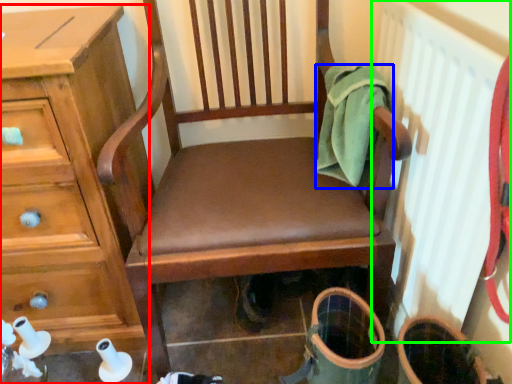
Question: Considering the real-world distances, which object is farthest from chest of drawers (highlighted by a red box)? clothing (highlighted by a blue box) or radiator (highlighted by a green box)?

Choices:
 (A) clothing
 (B) radiator

Answer: (B)